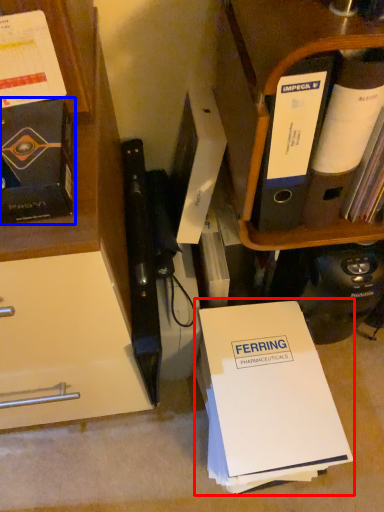
Question: Which object appears closest to the camera in this image, paperback book (highlighted by a red box) or book (highlighted by a blue box)?

Choices:
 (A) paperback book
 (B) book

Answer: (B)